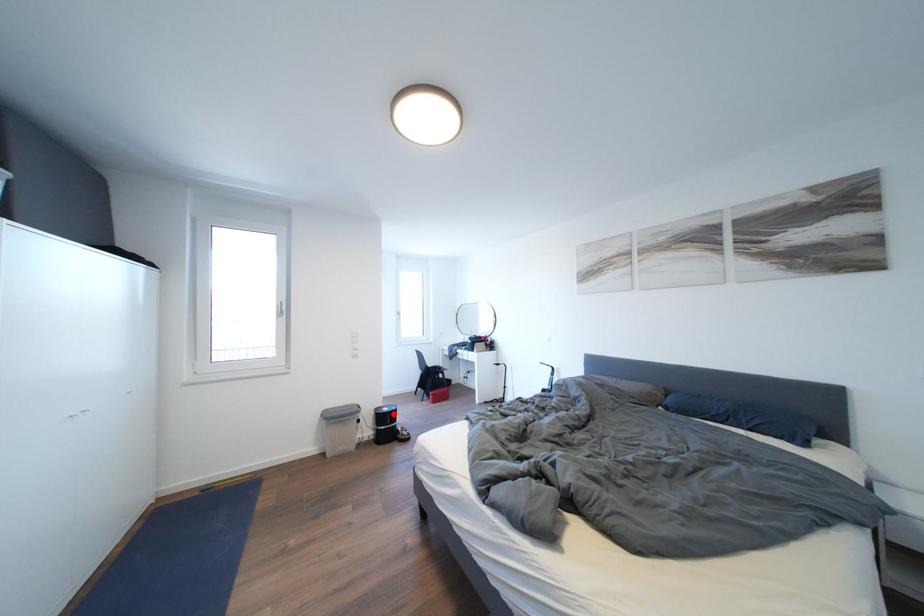
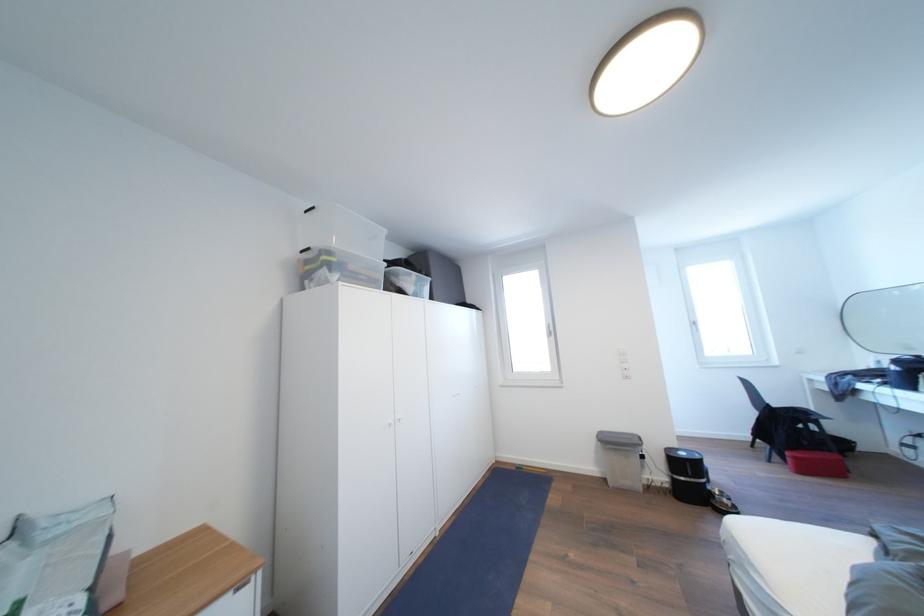
In the second image, find the point that corresponds to the highlighted location in the first image.

(689, 459)